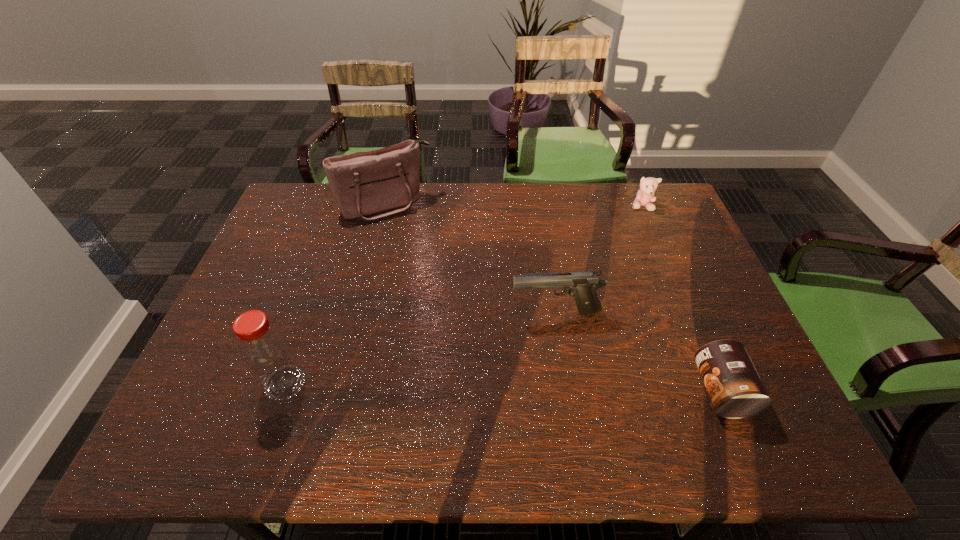
Identify the location of vacant area at the near edge of the desktop. This screenshot has height=540, width=960. (343, 408).

In the image, there is a desktop. Identify the location of vacant space at the left edge. (216, 369).

This screenshot has width=960, height=540. I want to click on free space at the right edge, so click(666, 285).

Where is `vacant space at the far left corner of the desktop`? The width and height of the screenshot is (960, 540). vacant space at the far left corner of the desktop is located at coordinates (311, 199).

The image size is (960, 540). What are the coordinates of `vacant space at the near left corner of the desktop` in the screenshot? It's located at (204, 379).

Find the location of a particular element. Image resolution: width=960 pixels, height=540 pixels. blank region between the third farthest object and the shoulder bag is located at coordinates (471, 259).

Identify the location of free space between the shoulder bag and the teddy bear. This screenshot has width=960, height=540. 515,206.

What are the coordinates of `vacant space that is in between the can and the bottle` in the screenshot? It's located at (503, 387).

What are the coordinates of `vacant area that lies between the can and the shoulder bag` in the screenshot? It's located at (554, 298).

The width and height of the screenshot is (960, 540). I want to click on vacant space that's between the shoulder bag and the teddy bear, so click(515, 206).